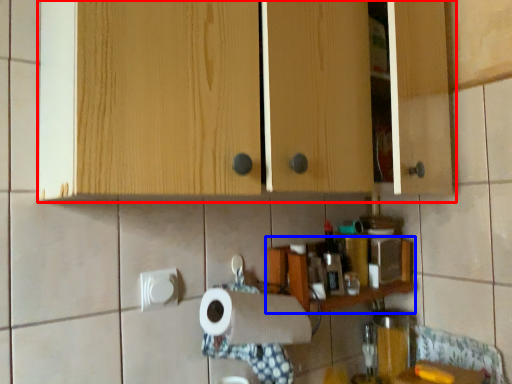
Question: Which point is closer to the camera, cabinetry (highlighted by a red box) or shelf (highlighted by a blue box)?

Choices:
 (A) cabinetry
 (B) shelf

Answer: (A)